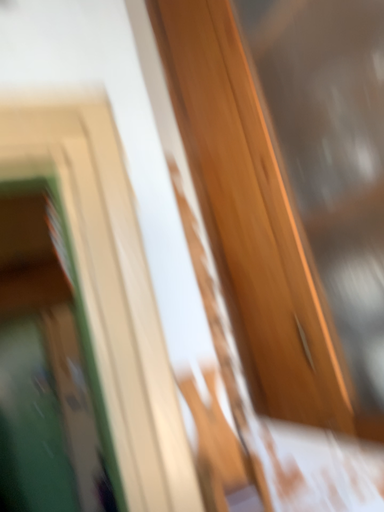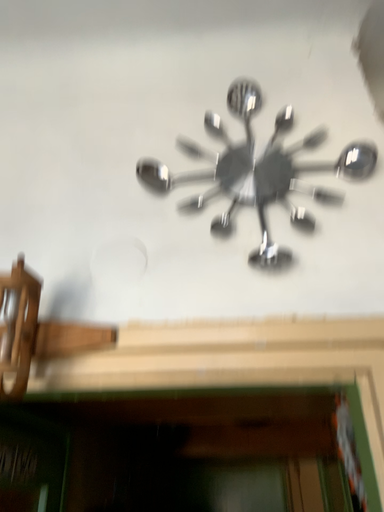
Question: How did the camera likely rotate when shooting the video?

Choices:
 (A) rotated upward
 (B) rotated downward

Answer: (A)